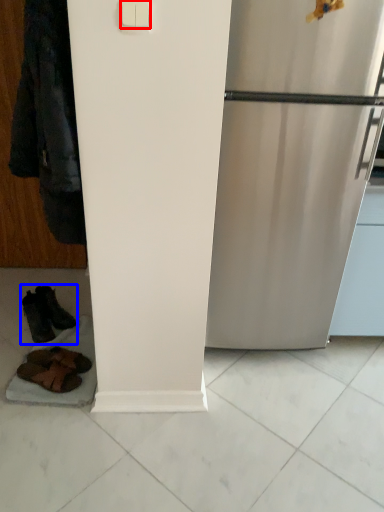
Question: Among these objects, which one is farthest to the camera, light switch (highlighted by a red box) or footwear (highlighted by a blue box)?

Choices:
 (A) light switch
 (B) footwear

Answer: (B)